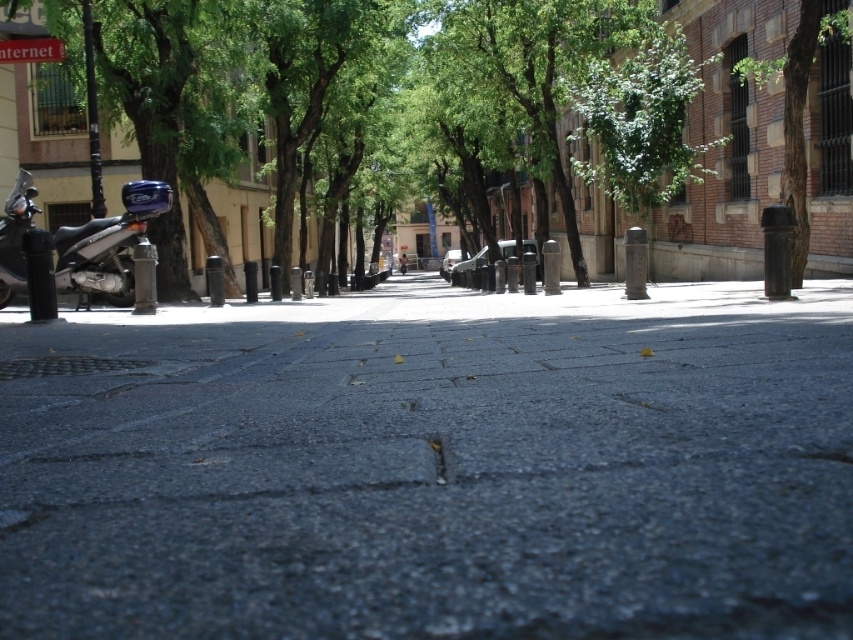
Measure the distance from gray asphalt pavement at center to green leafy tree at left.

The distance of gray asphalt pavement at center from green leafy tree at left is 9.39 meters.

Which is more to the left, gray asphalt pavement at center or green leafy tree at left?

green leafy tree at left is more to the left.

Describe the element at coordinates (432, 467) in the screenshot. I see `gray asphalt pavement at center` at that location.

The width and height of the screenshot is (853, 640). Identify the location of gray asphalt pavement at center. (432, 467).

Which is in front, point (766, 16) or point (763, 76)?

Point (763, 76) is more forward.

Which is in front, point (782, 26) or point (804, 148)?

Point (804, 148) is more forward.

Where is `green leafy tree at center`? The image size is (853, 640). green leafy tree at center is located at coordinates (724, 132).

Which is in front, point (459, 378) or point (1, 252)?

Point (459, 378) is more forward.

Does gray asphalt pavement at center appear on the left side of shiny metallic motorcycle at left?

No, gray asphalt pavement at center is not to the left of shiny metallic motorcycle at left.

Who is more distant from viewer, [57,412] or [22,260]?

The point [22,260] is behind.

This screenshot has width=853, height=640. In order to click on gray asphalt pavement at center in this screenshot , I will do `click(432, 467)`.